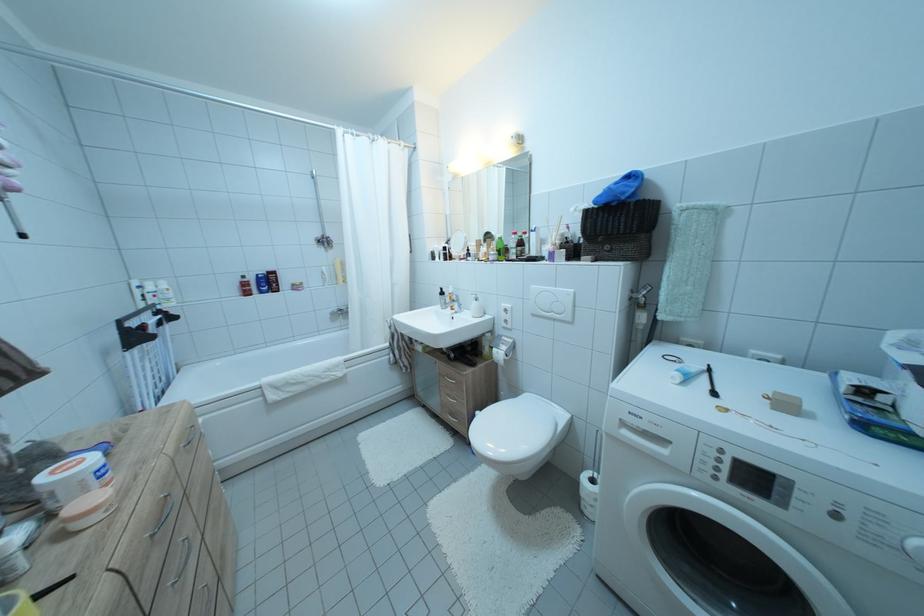
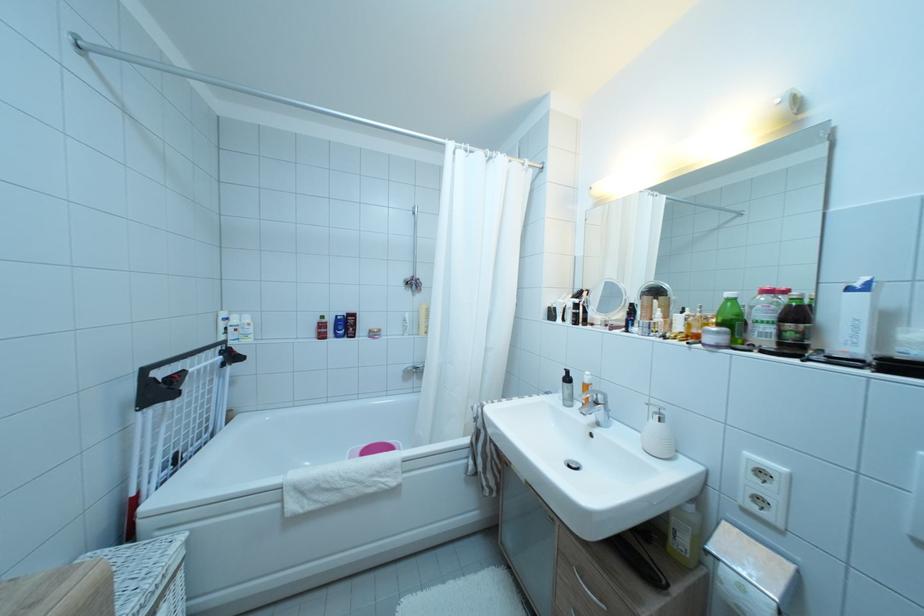
In the second image, find the point that corresponds to point (515, 254) in the first image.

(754, 330)